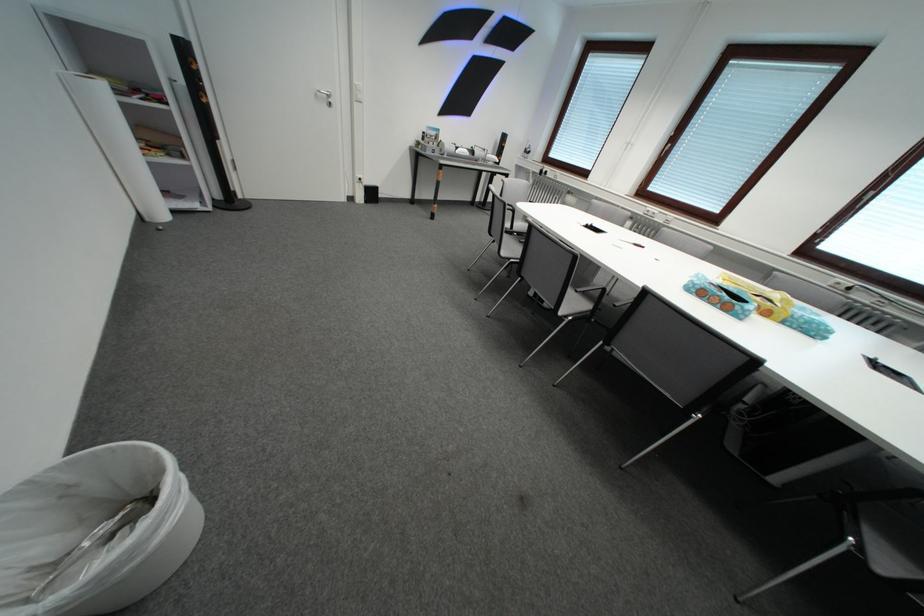
Find where to lift the yellow tissue box. Please return your answer as a coordinate pair (x, y).

(761, 297)